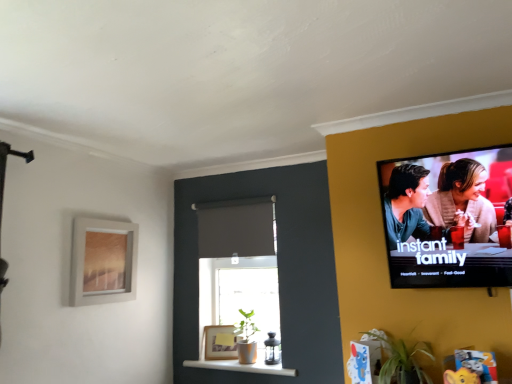
Question: From the image's perspective, is matte gold picture frame at lower center, the first picture frame viewed from the right, over green leafy plant at lower right?

Choices:
 (A) no
 (B) yes

Answer: (A)

Question: Is green leafy plant at lower right a part of matte gold picture frame at lower center, which is the second picture frame from front to back?

Choices:
 (A) no
 (B) yes

Answer: (A)

Question: Can you see matte gold picture frame at lower center, which is the second picture frame from front to back, touching green leafy plant at lower right?

Choices:
 (A) yes
 (B) no

Answer: (B)

Question: Does matte gold picture frame at lower center, the first picture frame viewed from the right, turn towards green leafy plant at lower right?

Choices:
 (A) no
 (B) yes

Answer: (A)

Question: Is matte gold picture frame at lower center, marked as the 1th picture frame in a back-to-front arrangement, turned away from green leafy plant at lower right?

Choices:
 (A) yes
 (B) no

Answer: (B)

Question: Considering the relative positions of matte gold picture frame at lower center, arranged as the 2th picture frame when viewed from the left, and green leafy plant at lower right in the image provided, is matte gold picture frame at lower center, arranged as the 2th picture frame when viewed from the left, to the left of green leafy plant at lower right from the viewer's perspective?

Choices:
 (A) yes
 (B) no

Answer: (A)

Question: Is green leafy plant at lower right closer to the viewer compared to matte gray curtain at center?

Choices:
 (A) no
 (B) yes

Answer: (B)

Question: From a real-world perspective, does green leafy plant at lower right stand above matte gray curtain at center?

Choices:
 (A) no
 (B) yes

Answer: (A)

Question: Considering the relative positions of green leafy plant at lower right and matte gray curtain at center in the image provided, is green leafy plant at lower right to the left of matte gray curtain at center from the viewer's perspective?

Choices:
 (A) yes
 (B) no

Answer: (B)

Question: Considering the relative sizes of green leafy plant at lower right and matte gray curtain at center in the image provided, is green leafy plant at lower right wider than matte gray curtain at center?

Choices:
 (A) yes
 (B) no

Answer: (A)

Question: From a real-world perspective, is green leafy plant at lower right located beneath matte gray curtain at center?

Choices:
 (A) yes
 (B) no

Answer: (A)

Question: Is green leafy plant at lower right positioned far away from matte gray curtain at center?

Choices:
 (A) no
 (B) yes

Answer: (B)

Question: Is green leafy plant at lower right aimed at matte silver picture frame at upper left, which is the 1th picture frame from top to bottom?

Choices:
 (A) no
 (B) yes

Answer: (A)